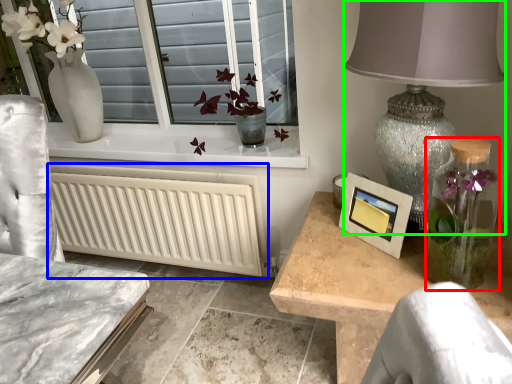
Question: Which object is positioned closest to glass vase (highlighted by a red box)? Select from radiator (highlighted by a blue box) and table lamp (highlighted by a green box).

Choices:
 (A) radiator
 (B) table lamp

Answer: (B)